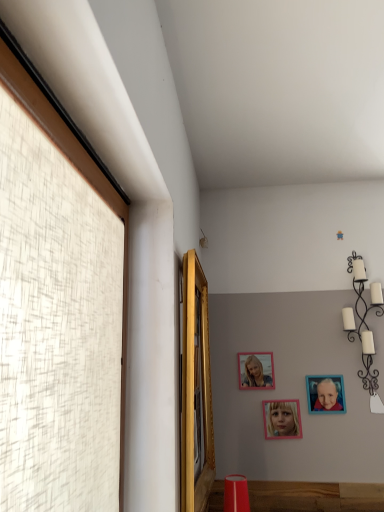
Question: Is point (249, 353) positioned closer to the camera than point (337, 402)?

Choices:
 (A) farther
 (B) closer

Answer: (A)

Question: Based on their sizes in the image, would you say pink matte picture frame at upper center, the 3th picture frame viewed from the right, is bigger or smaller than blue matte picture frame at upper right, the 3th picture frame from the left?

Choices:
 (A) small
 (B) big

Answer: (B)

Question: Estimate the real-world distances between objects in this image. Which object is closer to the white matte candle holder at upper right, acting as the first lamp starting from the right?

Choices:
 (A) pink matte picture frame at upper center, the 3th picture frame viewed from the right
 (B) gold wooden mirror at upper left, the 2th window positioned from the left
 (C) pink matte picture frame at center, acting as the 2th picture frame starting from the left
 (D) matte white lampshade at upper center, the 2th lamp positioned from the front
 (E) blue matte picture frame at upper right, marked as the 1th picture frame in a right-to-left arrangement

Answer: (E)

Question: Which object is the closest to the blue matte picture frame at upper right, marked as the 1th picture frame in a right-to-left arrangement?

Choices:
 (A) white matte candle holder at upper right, which is the 1th lamp from bottom to top
 (B) pink matte picture frame at center, arranged as the 2th picture frame when viewed from the right
 (C) matte white lampshade at upper center, which ranks as the 2th lamp in bottom-to-top order
 (D) pink matte picture frame at upper center, the 3th picture frame viewed from the right
 (E) white textured window at left, the first window positioned from the front

Answer: (B)